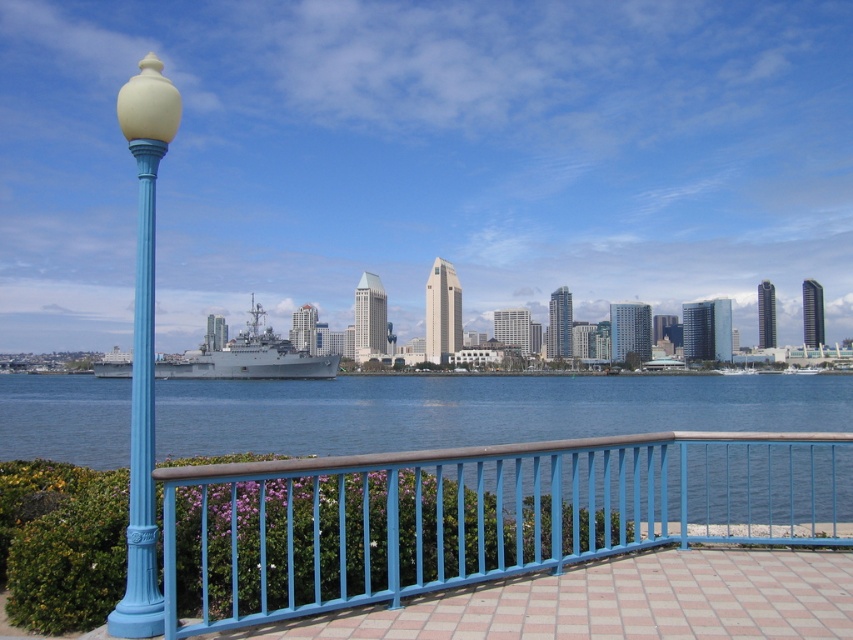
You are a photographer planning to capture the scenic waterfront view. You have a camera with a 10mm lens that can capture a width of 1 meter. The blue painted metal railing at center and the blue water at center are both in your frame. Which object is narrower in your photo?

The blue painted metal railing at center is thinner than the blue water at center, so the blue painted metal railing at center will appear narrower in the photo.

You are a photographer standing on the waterfront walkway. You want to take a photo that includes both the matte blue pole at left and the gray metallic ship at center. Which object will appear smaller in the photo?

The matte blue pole at left will appear smaller in the photo because it has a lesser height compared to the gray metallic ship at center.